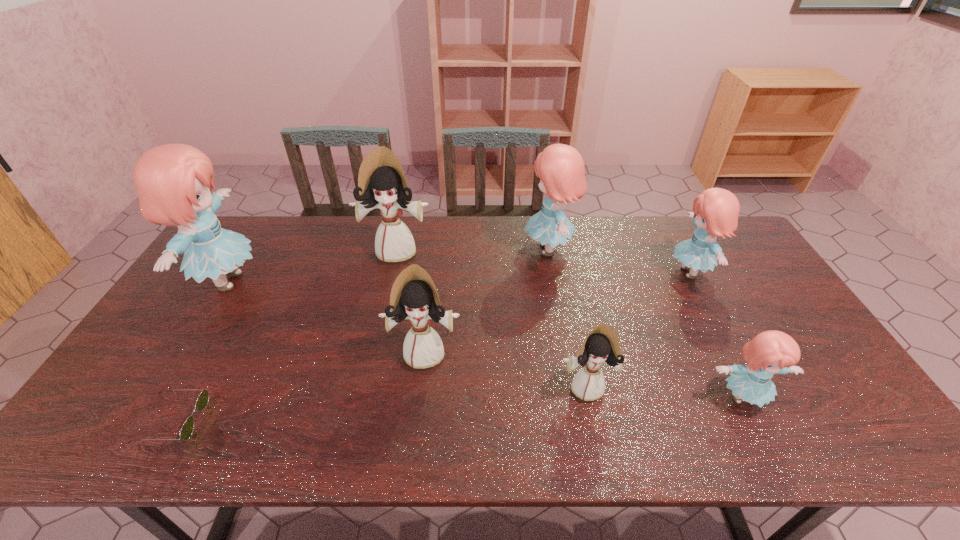
Where is `vacant space located 0.390m on the front-facing side of the tallest doll`? vacant space located 0.390m on the front-facing side of the tallest doll is located at coordinates (387, 281).

Locate an element on the screen. This screenshot has height=540, width=960. free space located 0.180m on the front-facing side of the second biggest blue doll is located at coordinates (469, 249).

I want to click on free space located 0.090m on the front-facing side of the second biggest blue doll, so click(495, 249).

This screenshot has width=960, height=540. I want to click on vacant area situated 0.070m on the front-facing side of the second biggest blue doll, so click(501, 249).

Image resolution: width=960 pixels, height=540 pixels. Identify the location of free region located at the front face of the biggest black doll. (387, 296).

Locate an element on the screen. vacant space located on the front-facing side of the second smallest blue doll is located at coordinates (595, 272).

In order to click on blank area located on the front-facing side of the second smallest blue doll in this screenshot , I will do coord(549,272).

Find the location of `free space located 0.150m on the front-facing side of the second smallest blue doll`. free space located 0.150m on the front-facing side of the second smallest blue doll is located at coordinates (620, 272).

Where is `vacant area situated 0.170m at the front face of the second smallest black doll`? The image size is (960, 540). vacant area situated 0.170m at the front face of the second smallest black doll is located at coordinates (416, 434).

Identify the location of vacant space located at the front face of the smallest black doll. This screenshot has width=960, height=540. (600, 451).